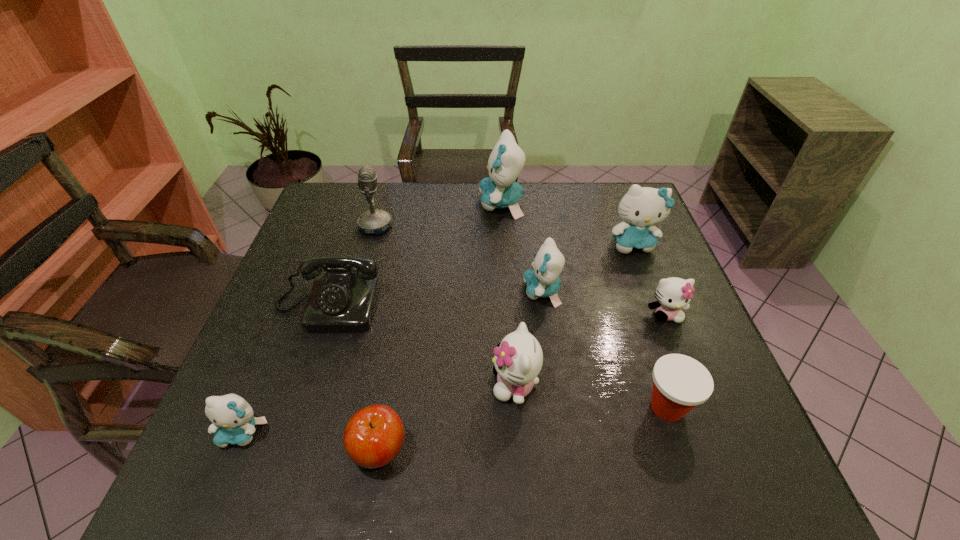
Choose which blue kitten is the nearest neighbor to the third biggest blue kitten. Please provide its 2D coordinates. Your answer should be formatted as a tuple, i.e. [(x, y)], where the tuple contains the x and y coordinates of a point satisfying the conditions above.

[(641, 207)]

Locate an element on the screen. This screenshot has height=540, width=960. free space that satisfies the following two spatial constraints: 1. on the face of the second nearest blue kitten; 2. on the dial of the black telephone is located at coordinates (544, 307).

You are a GUI agent. You are given a task and a screenshot of the screen. Output one action in this format:
    pyautogui.click(x=<x>, y=<y>)
    Task: Click on the vacant space that satisfies the following two spatial constraints: 1. on the front-facing side of the Dixie cup; 2. on the left side of the left white kitten
    
    Given the screenshot: What is the action you would take?
    pyautogui.click(x=516, y=407)

At what (x,y) coordinates should I click in order to perform the action: click on free spot that satisfies the following two spatial constraints: 1. on the face of the farthest blue kitten; 2. on the face of the smallest blue kitten. Please return your answer as a coordinate pair (x, y). The height and width of the screenshot is (540, 960). Looking at the image, I should click on (515, 433).

The image size is (960, 540). In order to click on blank area in the image that satisfies the following two spatial constraints: 1. on the face of the third farthest blue kitten; 2. on the face of the leftmost kitten in this screenshot , I will do `click(562, 433)`.

Where is `free location that satisfies the following two spatial constraints: 1. on the face of the third farthest blue kitten; 2. on the face of the smallest blue kitten`? The width and height of the screenshot is (960, 540). free location that satisfies the following two spatial constraints: 1. on the face of the third farthest blue kitten; 2. on the face of the smallest blue kitten is located at coordinates (562, 433).